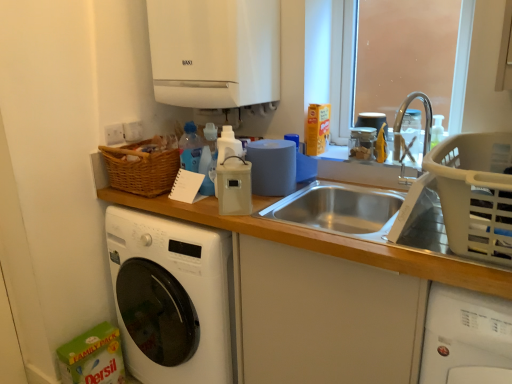
Question: From the image's perspective, is beige plastic container at center, which is counted as the first appliance, starting from the front, beneath white glossy boiler at upper center, which is the 2th appliance from front to back?

Choices:
 (A) yes
 (B) no

Answer: (A)

Question: Is beige plastic container at center, which is counted as the first appliance, starting from the front, next to white glossy boiler at upper center, which ranks as the 2th appliance in bottom-to-top order?

Choices:
 (A) no
 (B) yes

Answer: (A)

Question: Can you confirm if beige plastic container at center, the 1th appliance ordered from the bottom, is taller than white glossy boiler at upper center, the 1th appliance in the top-to-bottom sequence?

Choices:
 (A) yes
 (B) no

Answer: (B)

Question: From a real-world perspective, is beige plastic container at center, which ranks as the 2th appliance in top-to-bottom order, on white glossy boiler at upper center, placed as the first appliance when sorted from back to front?

Choices:
 (A) no
 (B) yes

Answer: (A)

Question: Does beige plastic container at center, placed as the 2th appliance when sorted from back to front, have a lesser height compared to white glossy boiler at upper center, placed as the first appliance when sorted from back to front?

Choices:
 (A) no
 (B) yes

Answer: (B)

Question: Is white plastic washing machine at lower right, the first washing machine positioned from the right, in front of or behind beige plastic container at center, the 1th appliance ordered from the bottom, in the image?

Choices:
 (A) behind
 (B) front

Answer: (B)

Question: Visually, is white plastic washing machine at lower right, the first washing machine positioned from the right, positioned to the left or to the right of beige plastic container at center, the 1th appliance ordered from the bottom?

Choices:
 (A) right
 (B) left

Answer: (A)

Question: Is point (429, 352) positioned closer to the camera than point (225, 195)?

Choices:
 (A) closer
 (B) farther

Answer: (A)

Question: From the image's perspective, is white plastic washing machine at lower right, the 2th washing machine viewed from the left, above or below beige plastic container at center, which is counted as the first appliance, starting from the front?

Choices:
 (A) above
 (B) below

Answer: (B)

Question: Is gray plastic basket at right in front of or behind white plastic washing machine at lower right, the first washing machine positioned from the right, in the image?

Choices:
 (A) behind
 (B) front

Answer: (B)

Question: From the image's perspective, is gray plastic basket at right above or below white plastic washing machine at lower right, the first washing machine positioned from the right?

Choices:
 (A) above
 (B) below

Answer: (A)

Question: Considering the positions of point (505, 135) and point (422, 362), is point (505, 135) closer or farther from the camera than point (422, 362)?

Choices:
 (A) closer
 (B) farther

Answer: (B)

Question: In terms of width, does gray plastic basket at right look wider or thinner when compared to white plastic washing machine at lower right, the first washing machine positioned from the right?

Choices:
 (A) thin
 (B) wide

Answer: (B)

Question: Choose the correct answer: Is white glossy boiler at upper center, which is the 2th appliance from front to back, inside white plastic washing machine at lower right, the first washing machine positioned from the right, or outside it?

Choices:
 (A) inside
 (B) outside

Answer: (B)

Question: Is white glossy boiler at upper center, the 1th appliance in the top-to-bottom sequence, taller or shorter than white plastic washing machine at lower right, the first washing machine positioned from the right?

Choices:
 (A) tall
 (B) short

Answer: (B)